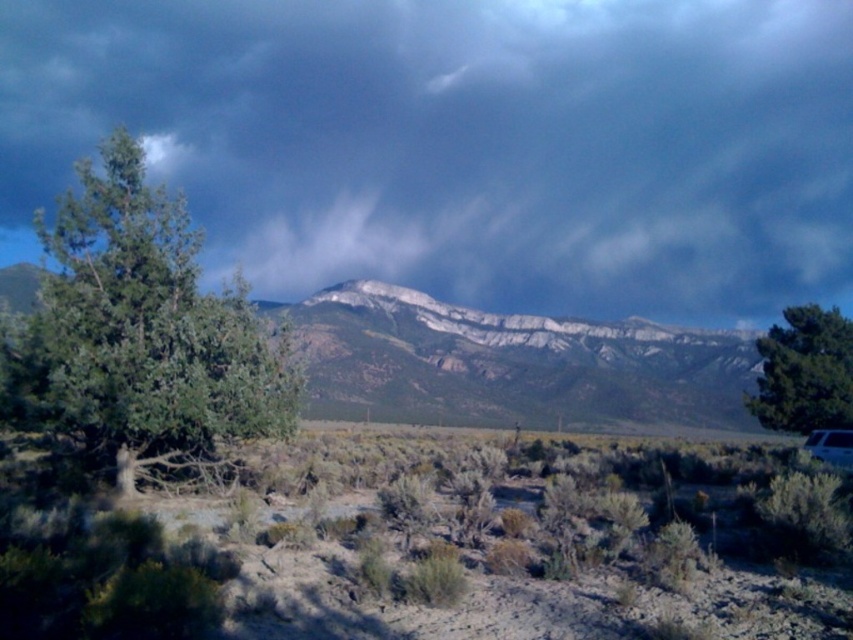
Question: Does green shrubbery at center lie behind green matte tree at left?

Choices:
 (A) no
 (B) yes

Answer: (A)

Question: Where is green leafy tree at right located in relation to white plastic recreational vehicle at lower right in the image?

Choices:
 (A) above
 (B) below

Answer: (A)

Question: Estimate the real-world distances between objects in this image. Which object is farther from the white plastic recreational vehicle at lower right?

Choices:
 (A) dark gray cloud at upper center
 (B) green matte tree at left
 (C) green shrubbery at center
 (D) green leafy tree at right

Answer: (A)

Question: In this image, where is green shrubbery at center located relative to rocky gray mountain range at center?

Choices:
 (A) above
 (B) below

Answer: (B)

Question: Which point is closer to the camera?

Choices:
 (A) (343, 620)
 (B) (730, 269)
 (C) (833, 461)

Answer: (A)

Question: Among these points, which one is nearest to the camera?

Choices:
 (A) (402, 404)
 (B) (97, 275)
 (C) (474, 273)
 (D) (846, 385)

Answer: (B)